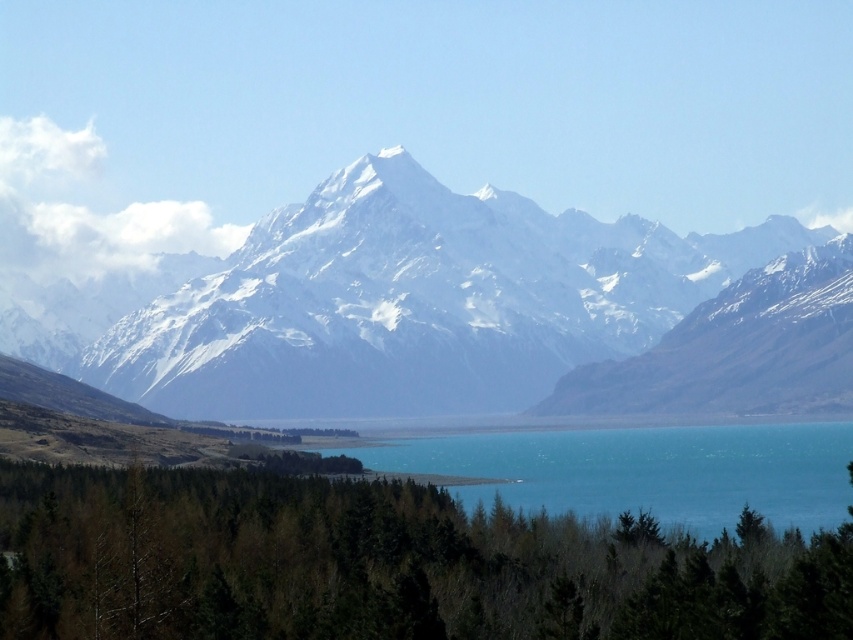
You are an artist planning to paint the landscape. You want to ensure the green matte trees at lower center and the turquoise glassy water at center are proportionally accurate. Which object should you paint first to maintain proper scale, and why?

You should paint the green matte trees at lower center first because they are larger in size than the turquoise glassy water at center. By starting with the larger object, you can establish the scale and ensure the smaller area of water fits appropriately within the composition.

You are a hiker planning to cross the turquoise glassy water at center using a 10 meter wide floating platform. The platform must also accommodate a path for your hiking gear. Given the green matte trees at lower center, will the platform fit between them and the water?

The green matte trees at lower center might be wider than the turquoise glassy water at center, so the 10 meter wide platform may not fit if the trees are wider than the water. Check the actual width before placing the platform.